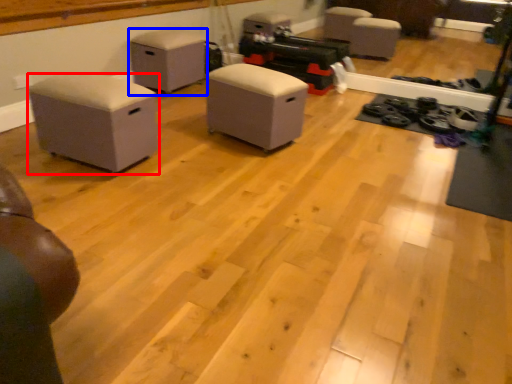
Question: Among these objects, which one is nearest to the camera, furniture (highlighted by a red box) or furniture (highlighted by a blue box)?

Choices:
 (A) furniture
 (B) furniture

Answer: (A)